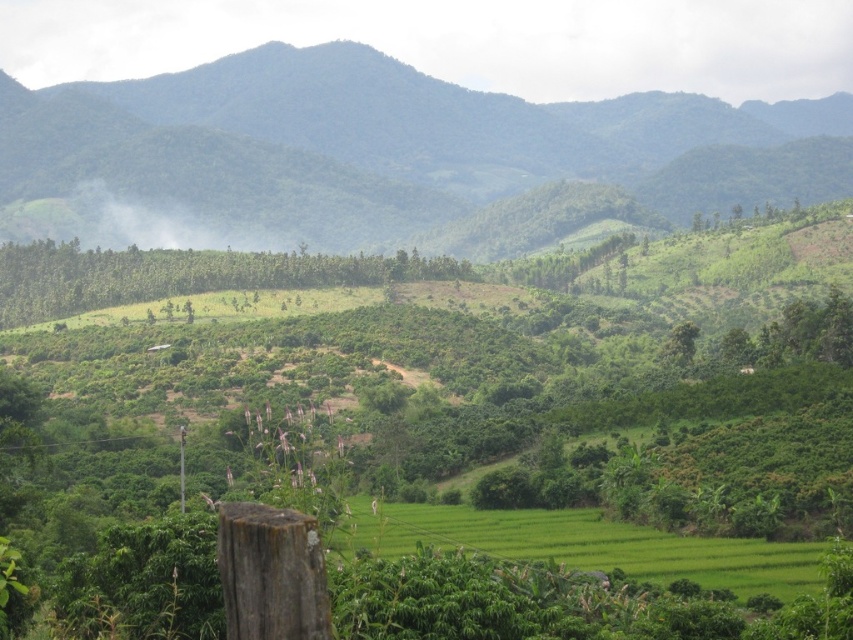
Can you confirm if green leafy mountain at center is thinner than green grassy field at center?

No, green leafy mountain at center is not thinner than green grassy field at center.

Does green leafy mountain at center have a greater width compared to green grassy field at center?

Correct, the width of green leafy mountain at center exceeds that of green grassy field at center.

Is point (509, 122) positioned in front of point (462, 540)?

No.

You are a GUI agent. You are given a task and a screenshot of the screen. Output one action in this format:
    pyautogui.click(x=<x>, y=<y>)
    Task: Click on the green leafy mountain at center
    
    Given the screenshot: What is the action you would take?
    pyautogui.click(x=381, y=154)